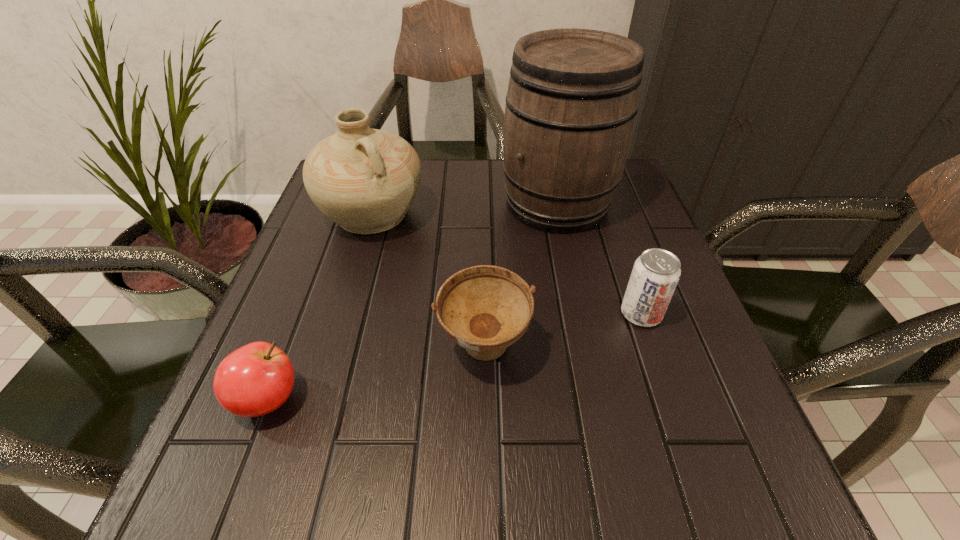
At what (x,y) coordinates should I click in order to perform the action: click on vacant space at the left edge of the desktop. Please return your answer as a coordinate pair (x, y). Looking at the image, I should click on (216, 424).

Where is `free space at the right edge`? The width and height of the screenshot is (960, 540). free space at the right edge is located at coordinates (611, 248).

Find the location of `vacant space that's between the soup bowl and the pottery`. vacant space that's between the soup bowl and the pottery is located at coordinates (428, 282).

Identify the location of blank region between the pottery and the wine bucket. Image resolution: width=960 pixels, height=540 pixels. (465, 209).

What are the coordinates of `vacant area that lies between the wine bucket and the fourth shortest object` in the screenshot? It's located at coord(465,209).

This screenshot has height=540, width=960. What are the coordinates of `blank region between the soda can and the fourth shortest object` in the screenshot? It's located at (507, 264).

Where is `vacant area that lies between the soda can and the soup bowl`? The height and width of the screenshot is (540, 960). vacant area that lies between the soda can and the soup bowl is located at coordinates (563, 332).

Locate an element on the screen. vacant point located between the apple and the fourth shortest object is located at coordinates (320, 307).

Find the location of a particular element. The image size is (960, 540). vacant space that is in between the wine bucket and the soda can is located at coordinates (599, 259).

You are a GUI agent. You are given a task and a screenshot of the screen. Output one action in this format:
    pyautogui.click(x=<x>, y=<y>)
    Task: Click on the vacant region between the shortest object and the wine bucket
    
    Given the screenshot: What is the action you would take?
    pyautogui.click(x=412, y=301)